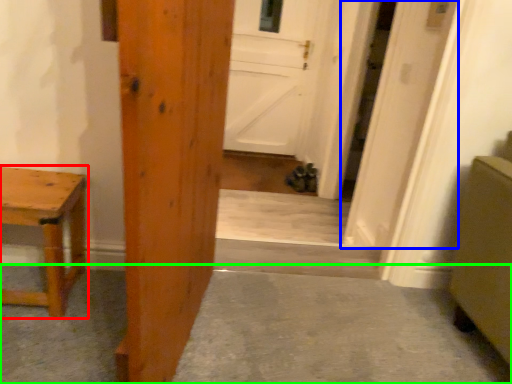
Question: Considering the real-world distances, which object is closest to table (highlighted by a red box)? door (highlighted by a blue box) or concrete (highlighted by a green box).

Choices:
 (A) door
 (B) concrete

Answer: (B)